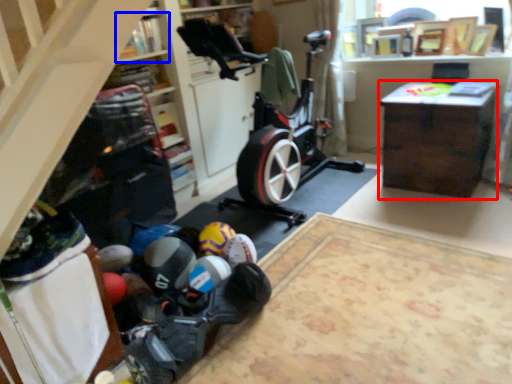
Question: Which point is closer to the camera, desk (highlighted by a red box) or shelf (highlighted by a blue box)?

Choices:
 (A) desk
 (B) shelf

Answer: (B)